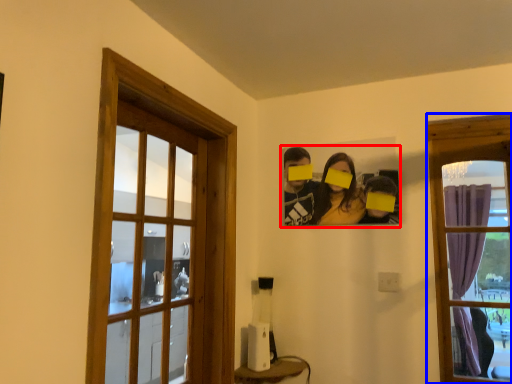
Question: Among these objects, which one is farthest to the camera, couple (highlighted by a red box) or window (highlighted by a blue box)?

Choices:
 (A) couple
 (B) window

Answer: (A)